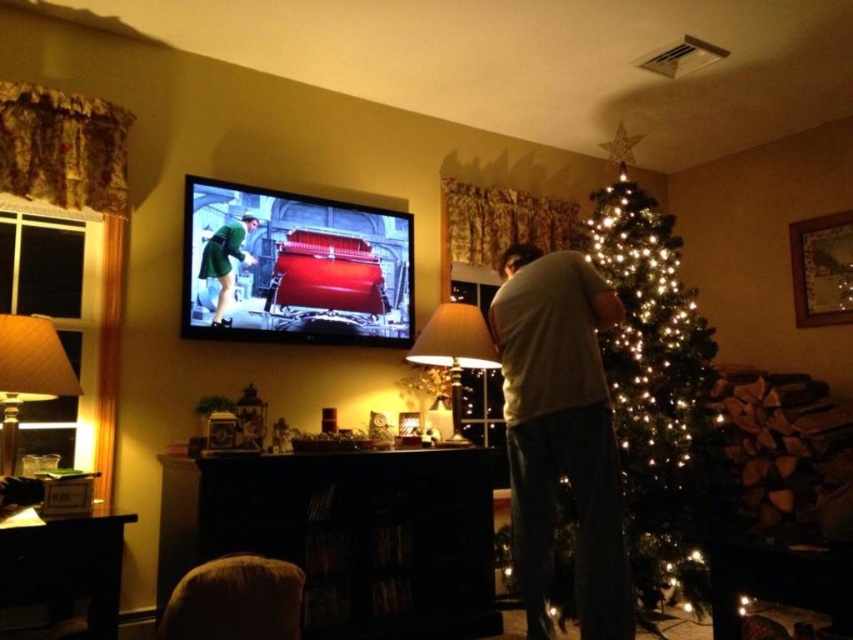
Who is positioned more to the left, illuminated green tree at center or green matte dress at upper left?

green matte dress at upper left is more to the left.

Is illuminated green tree at center bigger than green matte dress at upper left?

Indeed, illuminated green tree at center has a larger size compared to green matte dress at upper left.

Who is more forward, [643,449] or [212,317]?

Positioned in front is point [212,317].

Locate an element on the screen. This screenshot has width=853, height=640. illuminated green tree at center is located at coordinates (657, 385).

Which of these two, dark wood entertainment center at lower center or matte white lampshade at center, stands taller?

dark wood entertainment center at lower center is taller.

Is dark wood entertainment center at lower center thinner than matte white lampshade at center?

Incorrect, dark wood entertainment center at lower center's width is not less than matte white lampshade at center's.

Does point (368, 488) come closer to viewer compared to point (442, 308)?

Yes, point (368, 488) is closer to viewer.

The height and width of the screenshot is (640, 853). I want to click on dark wood entertainment center at lower center, so click(347, 536).

Can you confirm if illuminated green tree at center is thinner than matte white lampshade at center?

Incorrect, illuminated green tree at center's width is not less than matte white lampshade at center's.

Is illuminated green tree at center smaller than matte white lampshade at center?

Actually, illuminated green tree at center might be larger than matte white lampshade at center.

Is point (657, 221) positioned behind point (428, 353)?

Yes, point (657, 221) is farther from viewer.

At what (x,y) coordinates should I click in order to perform the action: click on illuminated green tree at center. Please return your answer as a coordinate pair (x, y). The image size is (853, 640). Looking at the image, I should click on (657, 385).